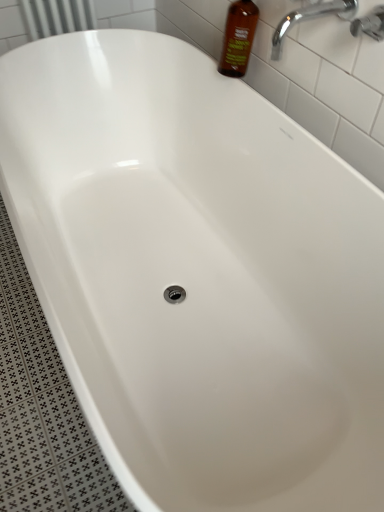
Question: Is the depth of brown glass bottle at upper right greater than that of chrome metallic faucet at upper right?

Choices:
 (A) no
 (B) yes

Answer: (B)

Question: Does brown glass bottle at upper right have a lesser height compared to chrome metallic faucet at upper right?

Choices:
 (A) no
 (B) yes

Answer: (A)

Question: Can you confirm if brown glass bottle at upper right is taller than chrome metallic faucet at upper right?

Choices:
 (A) yes
 (B) no

Answer: (A)

Question: Is brown glass bottle at upper right positioned beyond the bounds of chrome metallic faucet at upper right?

Choices:
 (A) no
 (B) yes

Answer: (B)

Question: From a real-world perspective, is brown glass bottle at upper right on top of chrome metallic faucet at upper right?

Choices:
 (A) no
 (B) yes

Answer: (A)

Question: Is brown glass bottle at upper right wider or thinner than chrome metallic faucet at upper right?

Choices:
 (A) thin
 (B) wide

Answer: (A)

Question: Visually, is brown glass bottle at upper right positioned to the left or to the right of chrome metallic faucet at upper right?

Choices:
 (A) right
 (B) left

Answer: (B)

Question: From the image's perspective, relative to chrome metallic faucet at upper right, is brown glass bottle at upper right above or below?

Choices:
 (A) above
 (B) below

Answer: (A)

Question: Considering their positions, is brown glass bottle at upper right located in front of or behind chrome metallic faucet at upper right?

Choices:
 (A) front
 (B) behind

Answer: (B)

Question: Considering the positions of point (380, 5) and point (241, 33), is point (380, 5) closer or farther from the camera than point (241, 33)?

Choices:
 (A) farther
 (B) closer

Answer: (B)

Question: Is chrome metallic faucet at upper right inside or outside of brown glass bottle at upper right?

Choices:
 (A) inside
 (B) outside

Answer: (B)

Question: Is chrome metallic faucet at upper right in front of or behind brown glass bottle at upper right in the image?

Choices:
 (A) front
 (B) behind

Answer: (A)

Question: Is chrome metallic faucet at upper right wider or thinner than brown glass bottle at upper right?

Choices:
 (A) wide
 (B) thin

Answer: (B)

Question: Which is correct: chrome metallic faucet at upper right is inside brown glass bottle at upper right, or outside of it?

Choices:
 (A) inside
 (B) outside

Answer: (B)

Question: Is chrome metallic faucet at upper right bigger or smaller than brown glass bottle at upper right?

Choices:
 (A) small
 (B) big

Answer: (A)